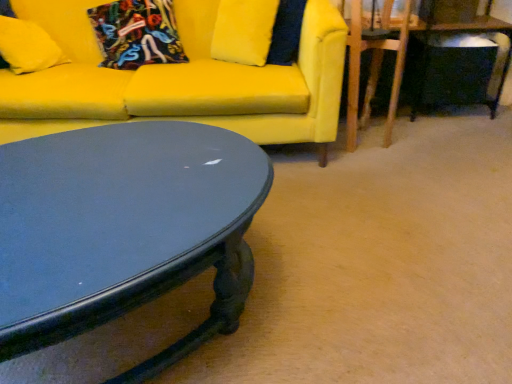
Where is `free spot below wooden swivel chair at right (from a real-world perspective)`? The height and width of the screenshot is (384, 512). free spot below wooden swivel chair at right (from a real-world perspective) is located at coordinates (361, 136).